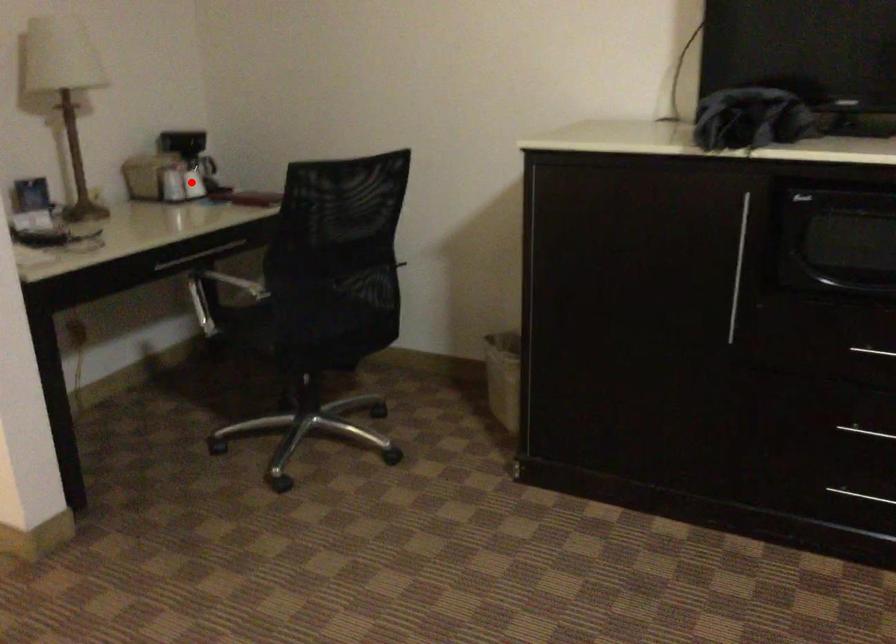
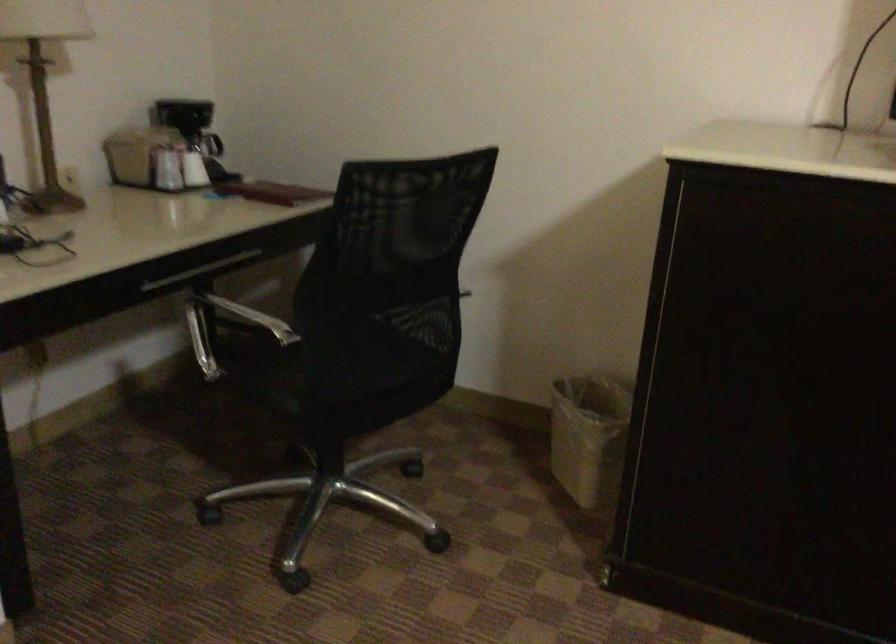
Locate, in the second image, the point that corresponds to the highlighted location in the first image.

(194, 169)